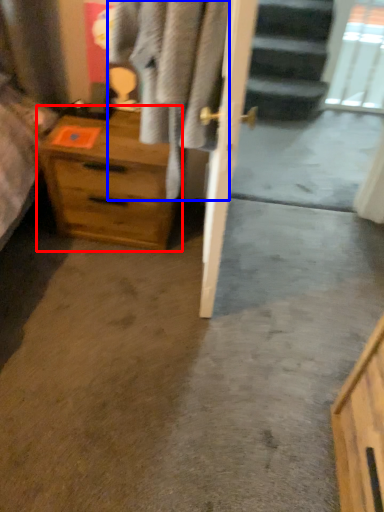
Question: Which point is further to the camera, chest of drawers (highlighted by a red box) or clothing (highlighted by a blue box)?

Choices:
 (A) chest of drawers
 (B) clothing

Answer: (A)